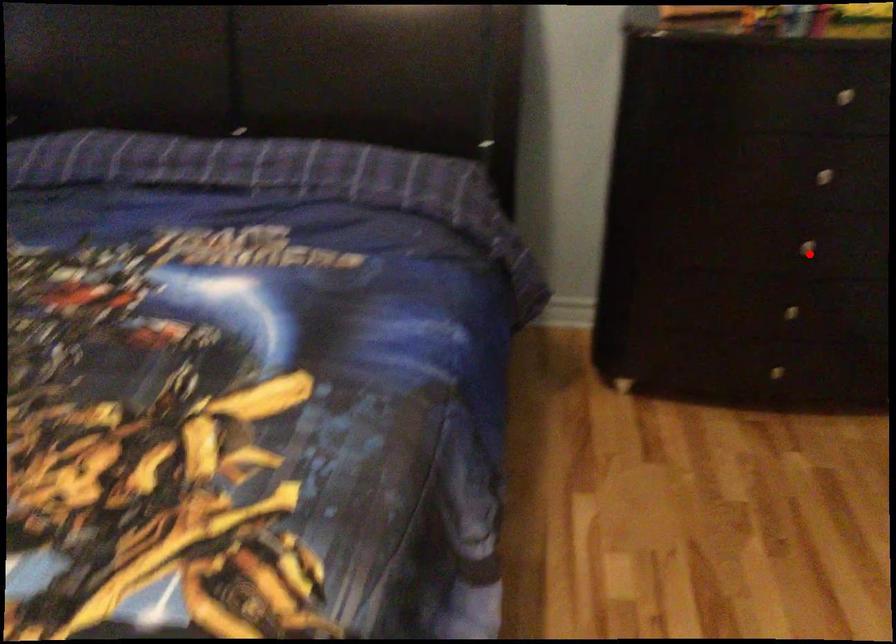
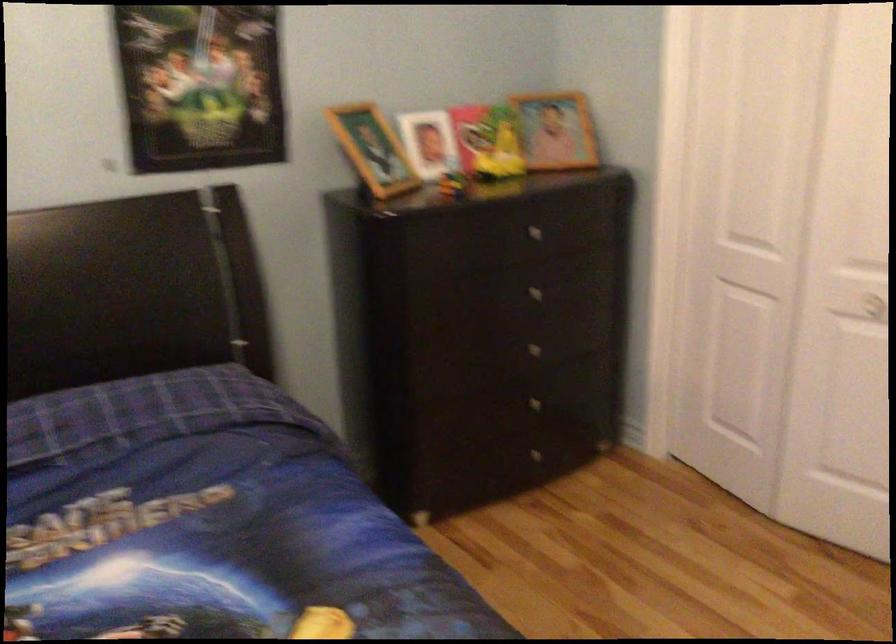
The point at the highlighted location is marked in the first image. Where is the corresponding point in the second image?

(539, 353)